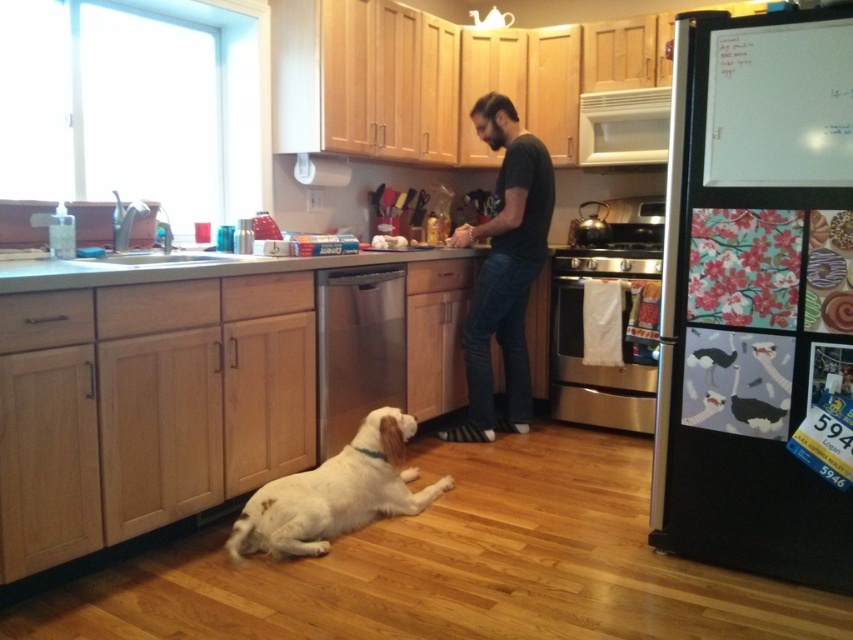
Based on the coordinates provided, where is the black cotton shirt at center located in the image?

The black cotton shirt at center is located at the 2D coordinates point (503, 269).